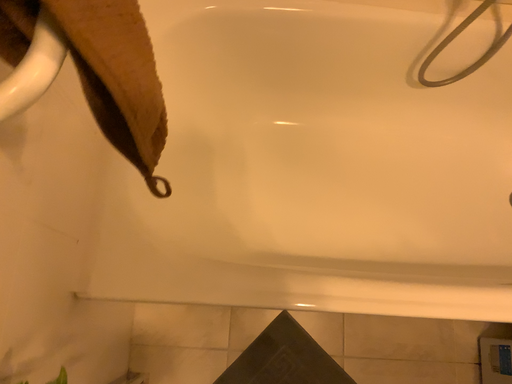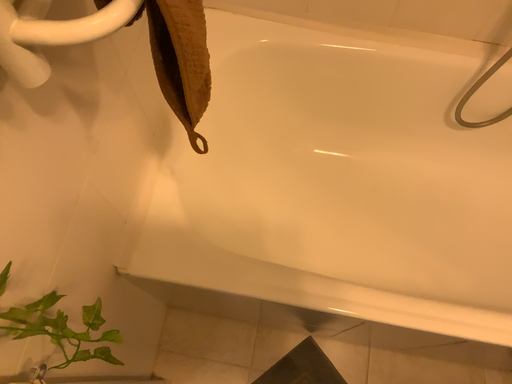
Question: How did the camera likely rotate when shooting the video?

Choices:
 (A) rotated downward
 (B) rotated upward

Answer: (B)